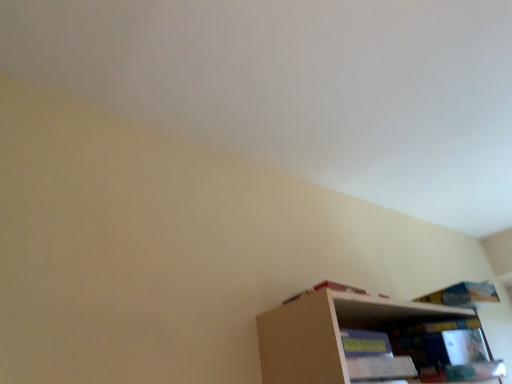
Image resolution: width=512 pixels, height=384 pixels. Find the location of `blue paper book at upper right, marked as the first book in a back-to-front arrangement`. blue paper book at upper right, marked as the first book in a back-to-front arrangement is located at coordinates (463, 295).

From the image's perspective, who appears lower, white cardboard book at upper right, the first book in the front-to-back sequence, or wooden bookshelf at lower right?

wooden bookshelf at lower right.

Can you confirm if white cardboard book at upper right, acting as the 2th book starting from the right, is thinner than wooden bookshelf at lower right?

Indeed, white cardboard book at upper right, acting as the 2th book starting from the right, has a lesser width compared to wooden bookshelf at lower right.

Is white cardboard book at upper right, acting as the 2th book starting from the right, to the left of wooden bookshelf at lower right from the viewer's perspective?

Yes, white cardboard book at upper right, acting as the 2th book starting from the right, is to the left of wooden bookshelf at lower right.

What's the angular difference between white cardboard book at upper right, which is the 2th book from back to front, and wooden bookshelf at lower right's facing directions?

The angular difference between white cardboard book at upper right, which is the 2th book from back to front, and wooden bookshelf at lower right is 3.2 degrees.

Is blue paper book at upper right, marked as the first book in a back-to-front arrangement, smaller than white cardboard book at upper right, which is the first book in left-to-right order?

Incorrect, blue paper book at upper right, marked as the first book in a back-to-front arrangement, is not smaller in size than white cardboard book at upper right, which is the first book in left-to-right order.

Does blue paper book at upper right, which appears as the 2th book when viewed from the left, appear on the left side of white cardboard book at upper right, the first book in the front-to-back sequence?

No, blue paper book at upper right, which appears as the 2th book when viewed from the left, is not to the left of white cardboard book at upper right, the first book in the front-to-back sequence.

Considering the relative positions of blue paper book at upper right, marked as the first book in a back-to-front arrangement, and white cardboard book at upper right, acting as the 2th book starting from the right, in the image provided, is blue paper book at upper right, marked as the first book in a back-to-front arrangement, in front of white cardboard book at upper right, acting as the 2th book starting from the right,?

That is False.

Which is in front, point (419, 299) or point (346, 287)?

The point (346, 287) is in front.

From a real-world perspective, is white cardboard book at upper right, acting as the 2th book starting from the right, on blue paper book at upper right, marked as the first book in a right-to-left arrangement?

Incorrect, from a real-world perspective, white cardboard book at upper right, acting as the 2th book starting from the right, is lower than blue paper book at upper right, marked as the first book in a right-to-left arrangement.

Is white cardboard book at upper right, acting as the 2th book starting from the right, smaller than blue paper book at upper right, marked as the first book in a right-to-left arrangement?

Yes.

Is white cardboard book at upper right, which is the 2th book from back to front, closer to the viewer compared to blue paper book at upper right, which appears as the 2th book when viewed from the left?

Yes, white cardboard book at upper right, which is the 2th book from back to front, is closer to the viewer.

Is wooden bookshelf at lower right aimed at blue paper book at upper right, marked as the first book in a right-to-left arrangement?

No, wooden bookshelf at lower right is not facing towards blue paper book at upper right, marked as the first book in a right-to-left arrangement.

Is the surface of wooden bookshelf at lower right in direct contact with blue paper book at upper right, placed as the second book when sorted from front to back?

No, wooden bookshelf at lower right is not with blue paper book at upper right, placed as the second book when sorted from front to back.

Is wooden bookshelf at lower right shorter than blue paper book at upper right, placed as the second book when sorted from front to back?

No, wooden bookshelf at lower right is not shorter than blue paper book at upper right, placed as the second book when sorted from front to back.

Is wooden bookshelf at lower right to the left or to the right of blue paper book at upper right, placed as the second book when sorted from front to back, in the image?

Clearly, wooden bookshelf at lower right is on the left of blue paper book at upper right, placed as the second book when sorted from front to back, in the image.

Considering the positions of objects wooden bookshelf at lower right and white cardboard book at upper right, which is the first book in left-to-right order, in the image provided, who is more to the right, wooden bookshelf at lower right or white cardboard book at upper right, which is the first book in left-to-right order,?

wooden bookshelf at lower right is more to the right.

Who is smaller, wooden bookshelf at lower right or white cardboard book at upper right, which is the first book in left-to-right order?

Smaller between the two is white cardboard book at upper right, which is the first book in left-to-right order.

Is point (451, 326) less distant than point (342, 287)?

No, (451, 326) is behind (342, 287).

Is white cardboard book at upper right, the first book in the front-to-back sequence, located within wooden bookshelf at lower right?

No, white cardboard book at upper right, the first book in the front-to-back sequence, is not surrounded by wooden bookshelf at lower right.

Is the position of blue paper book at upper right, which appears as the 2th book when viewed from the left, less distant than that of wooden bookshelf at lower right?

No.

Would you say blue paper book at upper right, placed as the second book when sorted from front to back, contains wooden bookshelf at lower right?

Actually, wooden bookshelf at lower right is outside blue paper book at upper right, placed as the second book when sorted from front to back.

From the image's perspective, which object appears higher, blue paper book at upper right, marked as the first book in a right-to-left arrangement, or wooden bookshelf at lower right?

blue paper book at upper right, marked as the first book in a right-to-left arrangement, appears higher in the image.

Who is smaller, blue paper book at upper right, marked as the first book in a back-to-front arrangement, or wooden bookshelf at lower right?

With smaller size is blue paper book at upper right, marked as the first book in a back-to-front arrangement.

I want to click on shelf below the white cardboard book at upper right, the first book in the front-to-back sequence (from the image's perspective), so click(x=419, y=349).

Locate an element on the screen. book above the white cardboard book at upper right, the first book in the front-to-back sequence (from a real-world perspective) is located at coordinates (463, 295).

Based on their spatial positions, is wooden bookshelf at lower right or white cardboard book at upper right, which is the 2th book from back to front, further from blue paper book at upper right, marked as the first book in a back-to-front arrangement?

white cardboard book at upper right, which is the 2th book from back to front, lies further to blue paper book at upper right, marked as the first book in a back-to-front arrangement, than the other object.

Estimate the real-world distances between objects in this image. Which object is closer to white cardboard book at upper right, which is the first book in left-to-right order, wooden bookshelf at lower right or blue paper book at upper right, marked as the first book in a right-to-left arrangement?

wooden bookshelf at lower right.

Estimate the real-world distances between objects in this image. Which object is further from white cardboard book at upper right, which is the first book in left-to-right order, blue paper book at upper right, placed as the second book when sorted from front to back, or wooden bookshelf at lower right?

Based on the image, blue paper book at upper right, placed as the second book when sorted from front to back, appears to be further to white cardboard book at upper right, which is the first book in left-to-right order.

When comparing their distances from wooden bookshelf at lower right, does white cardboard book at upper right, which is the first book in left-to-right order, or blue paper book at upper right, placed as the second book when sorted from front to back, seem further?

Based on the image, white cardboard book at upper right, which is the first book in left-to-right order, appears to be further to wooden bookshelf at lower right.

From the picture: From the image, which object appears to be nearer to blue paper book at upper right, marked as the first book in a right-to-left arrangement, white cardboard book at upper right, the first book in the front-to-back sequence, or wooden bookshelf at lower right?

wooden bookshelf at lower right is closer to blue paper book at upper right, marked as the first book in a right-to-left arrangement.

Which object lies nearer to the anchor point wooden bookshelf at lower right, blue paper book at upper right, marked as the first book in a right-to-left arrangement, or white cardboard book at upper right, which is the first book in left-to-right order?

blue paper book at upper right, marked as the first book in a right-to-left arrangement, is closer to wooden bookshelf at lower right.

Identify the location of shelf situated between white cardboard book at upper right, the first book in the front-to-back sequence, and blue paper book at upper right, which appears as the 2th book when viewed from the left, from left to right. (419, 349).